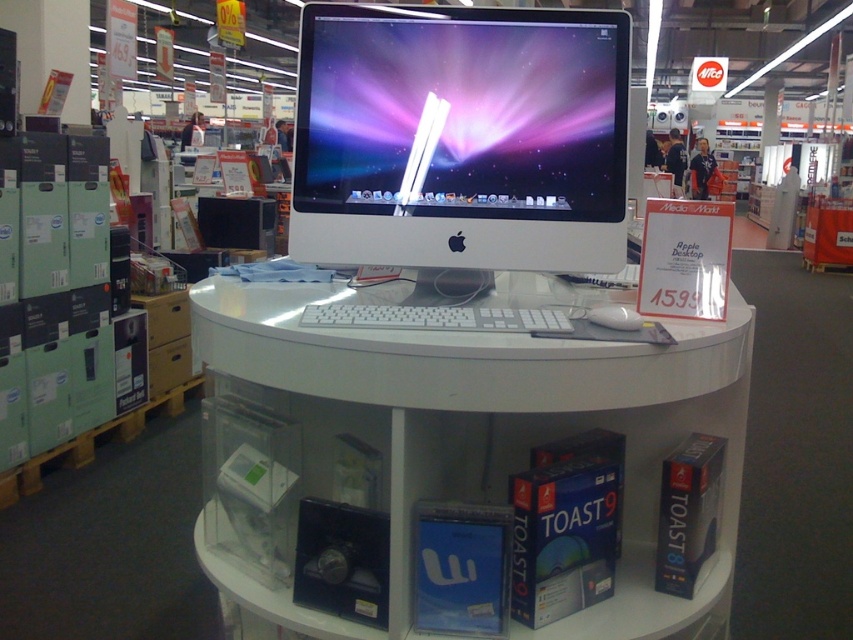
What do you see at coordinates (457, 464) in the screenshot? I see `white glossy computer desk at center` at bounding box center [457, 464].

Which is above, white glossy computer desk at center or white matte keyboard at center?

Positioned higher is white matte keyboard at center.

What do you see at coordinates (457, 464) in the screenshot? I see `white glossy computer desk at center` at bounding box center [457, 464].

Find the location of a particular element. This screenshot has width=853, height=640. white glossy computer desk at center is located at coordinates (457, 464).

Who is higher up, white glossy computer desk at center or white plastic mouse at center?

white plastic mouse at center

In order to click on white glossy computer desk at center in this screenshot , I will do `click(457, 464)`.

This screenshot has width=853, height=640. In order to click on white glossy computer desk at center in this screenshot , I will do `click(457, 464)`.

Which is more to the right, white glossy computer monitor at center or white plastic mouse at center?

Positioned to the right is white plastic mouse at center.

Is white glossy computer monitor at center below white plastic mouse at center?

Incorrect, white glossy computer monitor at center is not positioned below white plastic mouse at center.

This screenshot has width=853, height=640. Identify the location of white glossy computer monitor at center. (461, 141).

Locate an element on the screen. white glossy computer monitor at center is located at coordinates (461, 141).